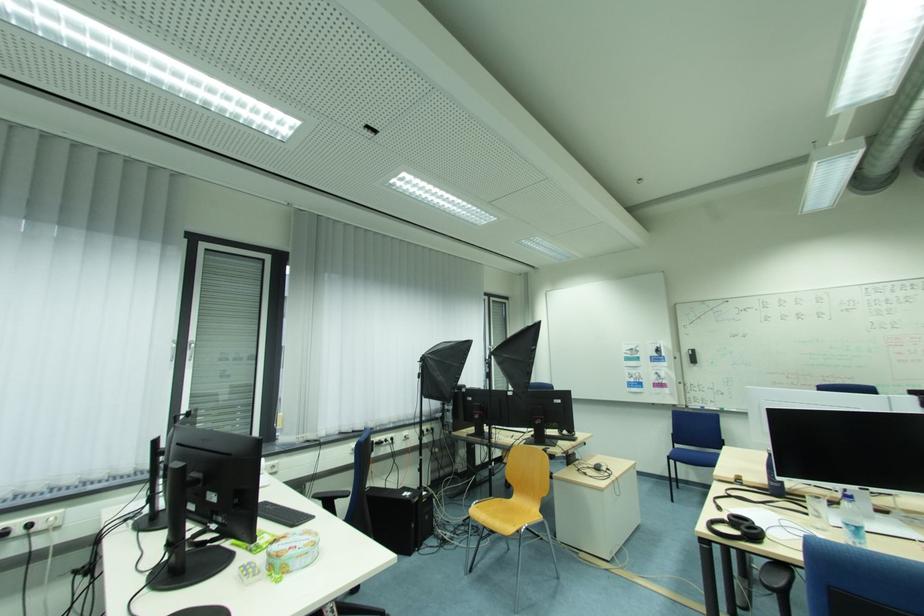
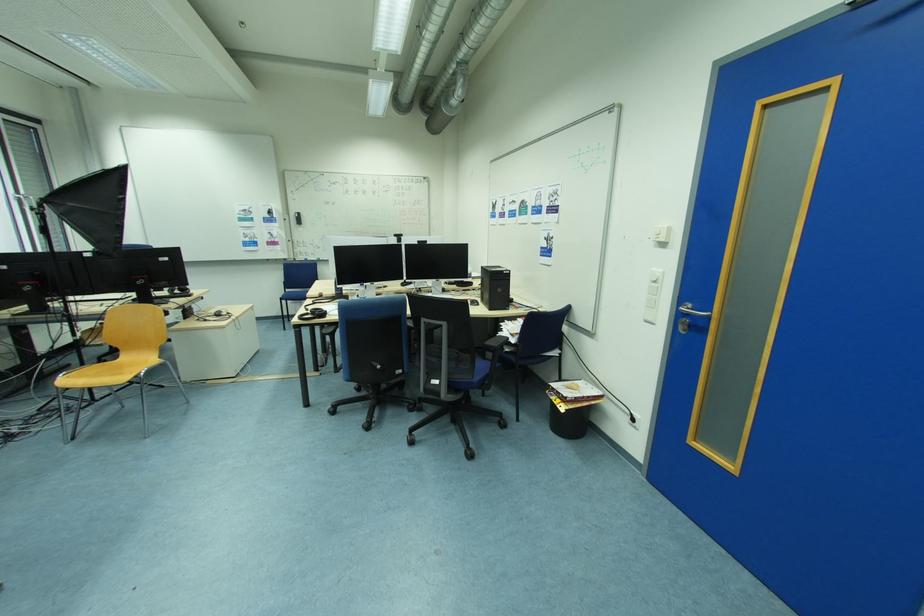
The point at (881, 507) is marked in the first image. Where is the corresponding point in the second image?

(383, 293)